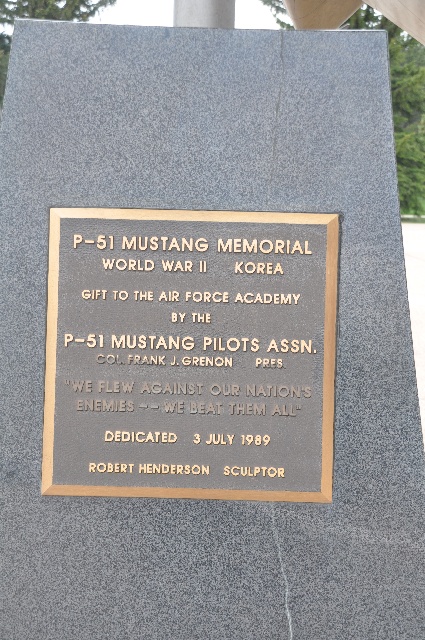
Find the location of a particular element. plaque is located at coordinates (302, 435).